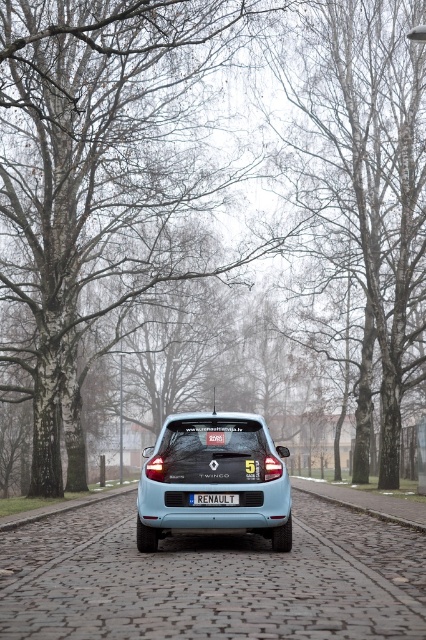
You are a delivery person trying to park your car on the cobblestone pavement at center and the cobblestone at lower center. Which parking spot has larger stones and would be more comfortable for your car?

The cobblestone pavement at center has a larger size compared to cobblestone at lower center, so it would be more comfortable for your car.

You are a delivery person trying to park a small car on the cobblestone pavement at center and the cobblestone at lower center. Based on their widths, which area would be more suitable for parking the car?

The cobblestone at lower center is narrower than the cobblestone pavement at center, so the cobblestone pavement at center would be more suitable for parking the car as it is wider and provides enough space.

You are a delivery driver who needs to park your vehicle on the cobblestone pavement at center. However, there is a light blue matte hatchback at center already parked there. Based on the scene, can you park your vehicle next to it without overlapping the existing car?

The light blue matte hatchback at center is located above cobblestone pavement at center, meaning it is parked on the pavement. Since the pavement is at the center, there might be space beside it depending on the street width. However, the scene does not provide information about the street width or available space, so it is uncertain if you can park next to it without overlapping.